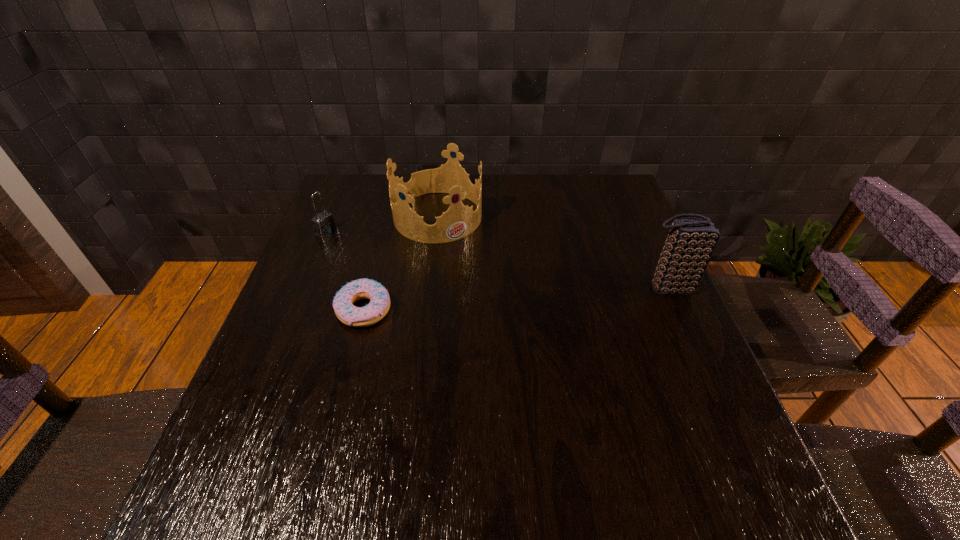
The width and height of the screenshot is (960, 540). Find the location of `doughnut`. doughnut is located at coordinates pos(346,312).

Find the location of a particular element. This screenshot has height=540, width=960. the tallest object is located at coordinates (691, 242).

Locate an element on the screen. This screenshot has height=540, width=960. the rightmost object is located at coordinates (691, 242).

The width and height of the screenshot is (960, 540). Identify the location of padlock. (324, 224).

The height and width of the screenshot is (540, 960). I want to click on the leftmost object, so click(324, 224).

You are a GUI agent. You are given a task and a screenshot of the screen. Output one action in this format:
    pyautogui.click(x=<x>, y=<y>)
    Task: Click on the tiara
    Image resolution: width=960 pixels, height=540 pixels.
    Given the screenshot: What is the action you would take?
    pyautogui.click(x=459, y=221)

The width and height of the screenshot is (960, 540). Identify the location of blank area located on the right of the shortest object. (473, 310).

The width and height of the screenshot is (960, 540). What are the coordinates of `free region located on the shackle of the third tallest object` in the screenshot? It's located at (379, 256).

You are a GUI agent. You are given a task and a screenshot of the screen. Output one action in this format:
    pyautogui.click(x=<x>, y=<y>)
    Task: Click on the free point located on the shackle of the third tallest object
    The image size is (960, 540).
    Given the screenshot: What is the action you would take?
    pyautogui.click(x=348, y=243)

Identify the location of free spot located 0.250m on the shackle of the third tallest object. (403, 267).